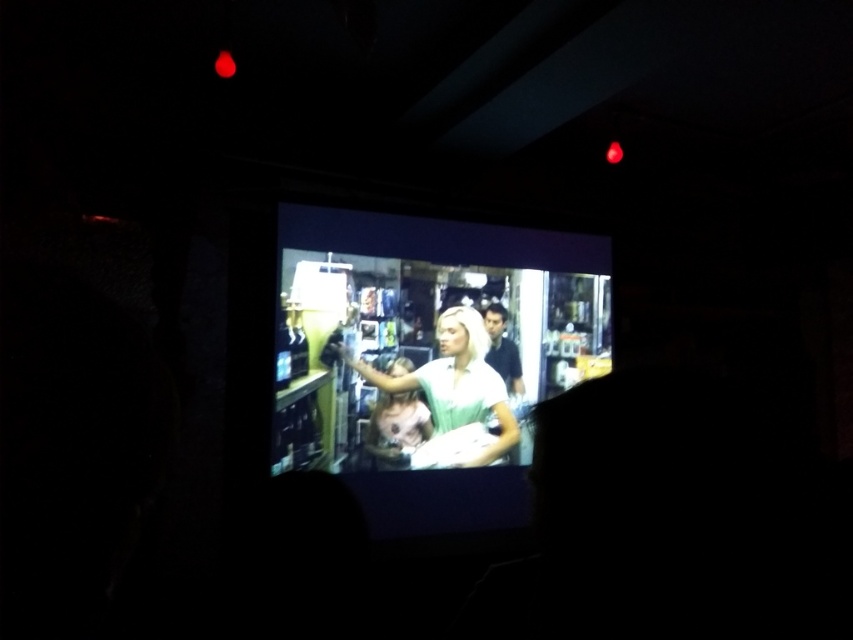
Question: Can you confirm if matte plastic screen at center is positioned to the left of matte white shirt at center?

Choices:
 (A) yes
 (B) no

Answer: (B)

Question: Can you confirm if matte white shirt at center is bigger than smooth white shirt at center?

Choices:
 (A) no
 (B) yes

Answer: (B)

Question: Which of the following is the closest to the observer?

Choices:
 (A) (451, 316)
 (B) (471, 355)
 (C) (512, 380)

Answer: (A)

Question: From the image, what is the correct spatial relationship of matte plastic screen at center in relation to matte white shirt at center?

Choices:
 (A) right
 (B) left

Answer: (A)

Question: Among these points, which one is nearest to the camera?

Choices:
 (A) (512, 392)
 (B) (491, 442)

Answer: (B)

Question: Which point is closer to the camera?

Choices:
 (A) matte white shirt at center
 (B) matte plastic screen at center
 (C) smooth white shirt at center

Answer: (B)